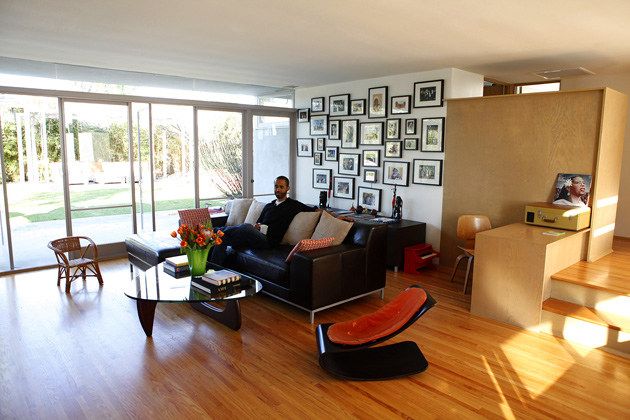
Where is `pillows`? Image resolution: width=630 pixels, height=420 pixels. pillows is located at coordinates (293, 234), (327, 230), (255, 209), (239, 207).